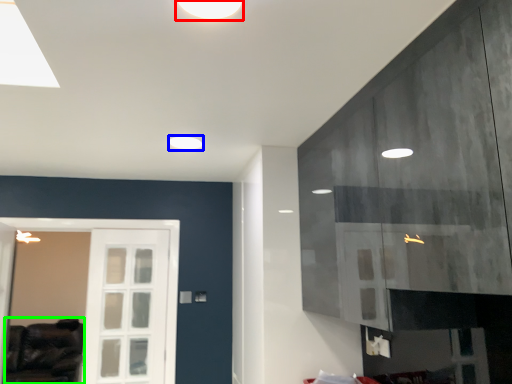
Question: Considering the real-world distances, which object is closest to lighting (highlighted by a red box)? lighting (highlighted by a blue box) or furniture (highlighted by a green box).

Choices:
 (A) lighting
 (B) furniture

Answer: (A)